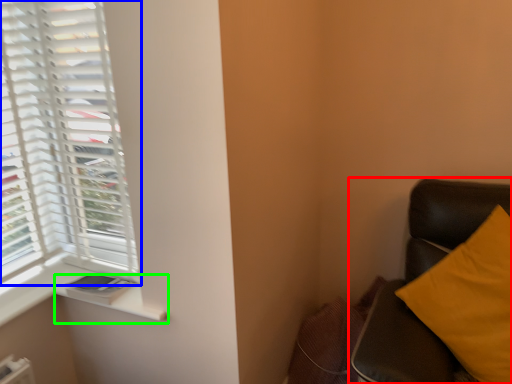
Question: Based on their relative distances, which object is farther from furniture (highlighted by a red box)? Choose from window (highlighted by a blue box) and window sill (highlighted by a green box).

Choices:
 (A) window
 (B) window sill

Answer: (A)